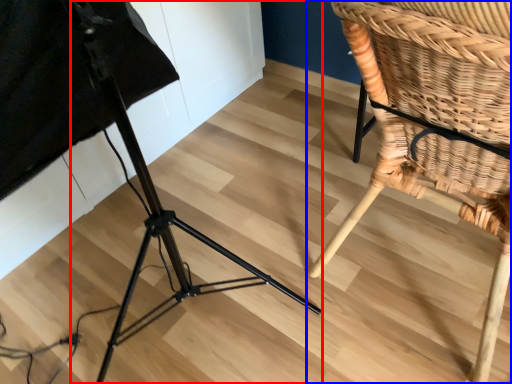
Question: Which point is further to the camera, tripod (highlighted by a red box) or chair (highlighted by a blue box)?

Choices:
 (A) tripod
 (B) chair

Answer: (B)